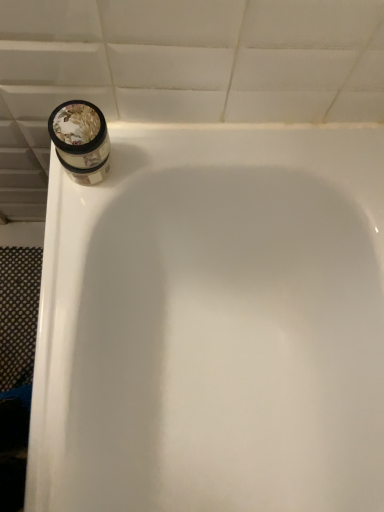
What do you see at coordinates (214, 325) in the screenshot?
I see `white glossy bathtub at upper left` at bounding box center [214, 325].

Find the location of a particular element. The image size is (384, 512). white glossy bathtub at upper left is located at coordinates (214, 325).

What is the approximate height of white glossy bathtub at upper left?

21.51 inches.

The image size is (384, 512). What are the coordinates of `white glossy bathtub at upper left` in the screenshot? It's located at (214, 325).